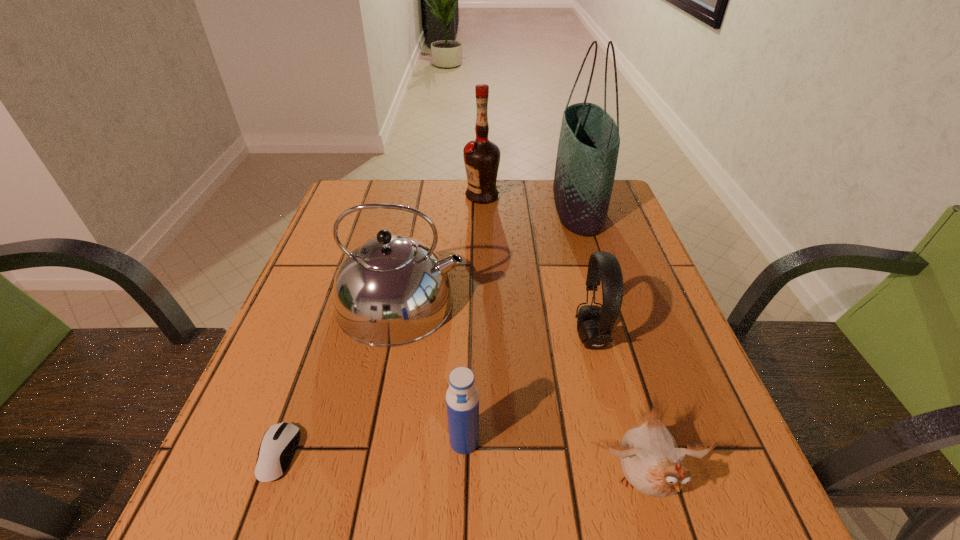
In the image, there is a desktop. In order to click on vacant space at the near edge in this screenshot , I will do `click(508, 521)`.

What are the coordinates of `vacant area at the left edge of the desktop` in the screenshot? It's located at (307, 323).

What are the coordinates of `vacant point at the right edge` in the screenshot? It's located at click(x=581, y=246).

At what (x,y) coordinates should I click in order to perform the action: click on free region at the far left corner of the desktop. Please return your answer as a coordinate pair (x, y). The width and height of the screenshot is (960, 540). Looking at the image, I should click on (354, 184).

In the image, there is a desktop. At what (x,y) coordinates should I click in order to perform the action: click on free space at the far right corner. Please return your answer as a coordinate pair (x, y). The image size is (960, 540). Looking at the image, I should click on (618, 207).

Locate an element on the screen. Image resolution: width=960 pixels, height=540 pixels. free spot between the tallest object and the sixth tallest object is located at coordinates (611, 346).

I want to click on free area in between the tallest object and the headset, so click(585, 272).

The height and width of the screenshot is (540, 960). Find the location of `unoccupied position between the kettle and the headset`. unoccupied position between the kettle and the headset is located at coordinates (x=496, y=320).

Where is `empty space between the water bottle and the headset`? This screenshot has height=540, width=960. empty space between the water bottle and the headset is located at coordinates coord(528,389).

Where is `free space between the mouse and the water bottle`? free space between the mouse and the water bottle is located at coordinates (372, 448).